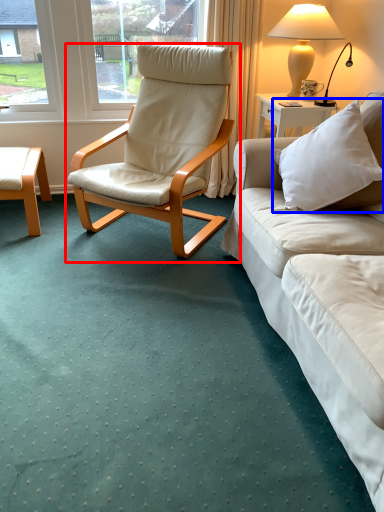
Question: Which object appears closest to the camera in this image, chair (highlighted by a red box) or pillow (highlighted by a blue box)?

Choices:
 (A) chair
 (B) pillow

Answer: (B)